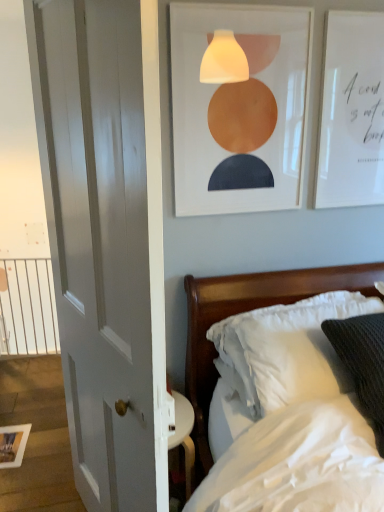
The width and height of the screenshot is (384, 512). What do you see at coordinates (13, 445) in the screenshot?
I see `wooden picture frame at lower left, acting as the third picture frame starting from the right` at bounding box center [13, 445].

This screenshot has height=512, width=384. I want to click on wooden picture frame at lower left, acting as the third picture frame starting from the right, so click(13, 445).

This screenshot has width=384, height=512. Describe the element at coordinates (351, 111) in the screenshot. I see `white paper at upper right, which appears as the 3th picture frame when ordered from the bottom` at that location.

Image resolution: width=384 pixels, height=512 pixels. In order to click on white smooth door at left in this screenshot , I will do `click(106, 238)`.

In terms of width, does wooden bed at right look wider or thinner when compared to white soft pillow at lower right?

Considering their sizes, wooden bed at right looks broader than white soft pillow at lower right.

Does wooden bed at right have a larger size compared to white soft pillow at lower right?

Yes.

Is wooden bed at right beside white soft pillow at lower right?

No, wooden bed at right is not next to white soft pillow at lower right.

Is wooden bed at right oriented towards white soft pillow at lower right?

Yes, wooden bed at right faces towards white soft pillow at lower right.

Can you confirm if wooden bed at right is shorter than white paper at upper right, which appears as the 3th picture frame when ordered from the bottom?

Yes.

Which object is wider, wooden bed at right or white paper at upper right, acting as the 1th picture frame starting from the right?

With larger width is wooden bed at right.

What's the angular difference between wooden bed at right and white paper at upper right, the 2th picture frame positioned from the front,'s facing directions?

1.45 degrees.

Are wooden bed at right and white paper at upper right, acting as the 1th picture frame starting from the right, beside each other?

wooden bed at right is not next to white paper at upper right, acting as the 1th picture frame starting from the right, and they're not touching.

From a real-world perspective, between white matte picture frame at upper center, the first picture frame from the front, and wooden bed at right, who is vertically higher?

From a 3D spatial view, white matte picture frame at upper center, the first picture frame from the front, is above.

Would you say white matte picture frame at upper center, placed as the second picture frame when sorted from bottom to top, is inside or outside wooden bed at right?

white matte picture frame at upper center, placed as the second picture frame when sorted from bottom to top, exists outside the volume of wooden bed at right.

Are white matte picture frame at upper center, the first picture frame from the front, and wooden bed at right making contact?

No, white matte picture frame at upper center, the first picture frame from the front, is not beside wooden bed at right.

Which of these two, white soft pillow at lower right or wooden bed at right, is smaller?

white soft pillow at lower right is smaller.

In terms of width, does white soft pillow at lower right look wider or thinner when compared to wooden bed at right?

Clearly, white soft pillow at lower right has less width compared to wooden bed at right.

Who is more distant, white soft pillow at lower right or wooden bed at right?

white soft pillow at lower right is further from the camera.

The image size is (384, 512). I want to click on bed positioned vertically above the white soft pillow at lower right (from a real-world perspective), so click(x=245, y=311).

This screenshot has width=384, height=512. I want to click on balustrade below the white soft pillow at lower right (from a real-world perspective), so click(27, 307).

From a real-world perspective, who is located lower, white metal balustrade at left or white soft pillow at lower right?

white metal balustrade at left.

Relative to white soft pillow at lower right, is white metal balustrade at left in front or behind?

white metal balustrade at left is positioned farther from the viewer than white soft pillow at lower right.

Is white metal balustrade at left facing away from white soft pillow at lower right?

white metal balustrade at left does not have its back to white soft pillow at lower right.

Considering the relative positions of white smooth door at left and white matte picture frame at upper center, which is the third picture frame from back to front, in the image provided, is white smooth door at left to the left of white matte picture frame at upper center, which is the third picture frame from back to front, from the viewer's perspective?

Correct, you'll find white smooth door at left to the left of white matte picture frame at upper center, which is the third picture frame from back to front.

In the scene shown: Is there a large distance between white smooth door at left and white matte picture frame at upper center, which is the third picture frame from back to front?

white smooth door at left is actually quite close to white matte picture frame at upper center, which is the third picture frame from back to front.

Considering the relative sizes of white smooth door at left and white matte picture frame at upper center, which is counted as the second picture frame, starting from the top, in the image provided, is white smooth door at left shorter than white matte picture frame at upper center, which is counted as the second picture frame, starting from the top,?

Incorrect, the height of white smooth door at left does not fall short of that of white matte picture frame at upper center, which is counted as the second picture frame, starting from the top.

Is white smooth door at left in front of or behind white matte picture frame at upper center, the 2th picture frame from the left, in the image?

Visually, white smooth door at left is located in front of white matte picture frame at upper center, the 2th picture frame from the left.

Considering the sizes of white metal balustrade at left and wooden picture frame at lower left, the third picture frame viewed from the front, in the image, is white metal balustrade at left wider or thinner than wooden picture frame at lower left, the third picture frame viewed from the front,?

In the image, white metal balustrade at left appears to be more narrow than wooden picture frame at lower left, the third picture frame viewed from the front.

From a real-world perspective, is white metal balustrade at left beneath wooden picture frame at lower left, which appears as the first picture frame when viewed from the left?

No, from a real-world perspective, white metal balustrade at left is not below wooden picture frame at lower left, which appears as the first picture frame when viewed from the left.

In the image, is white metal balustrade at left on the left side or the right side of wooden picture frame at lower left, which appears as the first picture frame when viewed from the left?

In the image, white metal balustrade at left appears on the left side of wooden picture frame at lower left, which appears as the first picture frame when viewed from the left.

Is the surface of white metal balustrade at left in direct contact with wooden picture frame at lower left, acting as the third picture frame starting from the right?

They are not placed beside each other.

Identify the location of pillow behind the wooden bed at right. (x=288, y=350).

Find the location of `picture frame that is the 2nd object located above the wooden bed at right (from the image's perspective)`. picture frame that is the 2nd object located above the wooden bed at right (from the image's perspective) is located at coordinates (351, 111).

Estimate the real-world distances between objects in this image. Which object is closer to wooden picture frame at lower left, which ranks as the third picture frame in top-to-bottom order, white smooth door at left or wooden bed at right?

white smooth door at left is positioned closer to the anchor wooden picture frame at lower left, which ranks as the third picture frame in top-to-bottom order.

Estimate the real-world distances between objects in this image. Which object is closer to white smooth door at left, white soft pillow at lower right or wooden bed at right?

wooden bed at right is closer to white smooth door at left.

Which object lies further to the anchor point white matte picture frame at upper center, the 2th picture frame from the left, wooden bed at right or white soft pillow at lower right?

Among the two, white soft pillow at lower right is located further to white matte picture frame at upper center, the 2th picture frame from the left.

Based on their spatial positions, is white matte picture frame at upper center, placed as the second picture frame when sorted from bottom to top, or white soft pillow at lower right closer to wooden picture frame at lower left, acting as the third picture frame starting from the right?

white soft pillow at lower right is positioned closer to the anchor wooden picture frame at lower left, acting as the third picture frame starting from the right.

From the image, which object appears to be nearer to white paper at upper right, the 2th picture frame positioned from the front, white metal balustrade at left or wooden bed at right?

Among the two, wooden bed at right is located nearer to white paper at upper right, the 2th picture frame positioned from the front.

From the image, which object appears to be nearer to white matte picture frame at upper center, which is counted as the second picture frame, starting from the top, white paper at upper right, which appears as the 3th picture frame when ordered from the bottom, or wooden bed at right?

Based on the image, white paper at upper right, which appears as the 3th picture frame when ordered from the bottom, appears to be nearer to white matte picture frame at upper center, which is counted as the second picture frame, starting from the top.

From the image, which object appears to be nearer to white soft pillow at lower right, wooden picture frame at lower left, which appears as the first picture frame when viewed from the left, or wooden bed at right?

wooden bed at right.

Based on their spatial positions, is white smooth door at left or white metal balustrade at left further from white paper at upper right, the 2th picture frame positioned from the front?

Based on the image, white metal balustrade at left appears to be further to white paper at upper right, the 2th picture frame positioned from the front.

Where is `door that lies between white matte picture frame at upper center, placed as the second picture frame when sorted from bottom to top, and white soft pillow at lower right from top to bottom`? Image resolution: width=384 pixels, height=512 pixels. door that lies between white matte picture frame at upper center, placed as the second picture frame when sorted from bottom to top, and white soft pillow at lower right from top to bottom is located at coordinates (106, 238).

Image resolution: width=384 pixels, height=512 pixels. I want to click on bed between white smooth door at left and white metal balustrade at left in the front-back direction, so click(245, 311).

Find the location of a particular element. Image resolution: width=384 pixels, height=512 pixels. bed between wooden picture frame at lower left, which ranks as the first picture frame in bottom-to-top order, and white paper at upper right, acting as the 1th picture frame starting from the right is located at coordinates (245, 311).

Identify the location of bed between white matte picture frame at upper center, the first picture frame from the front, and wooden picture frame at lower left, which ranks as the first picture frame in back-to-front order, vertically. This screenshot has width=384, height=512. (245, 311).